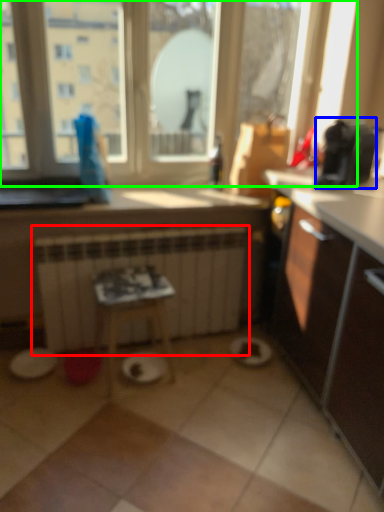
Question: Which object is positioned farthest from radiator (highlighted by a red box)? Select from appliance (highlighted by a blue box) and window (highlighted by a green box).

Choices:
 (A) appliance
 (B) window

Answer: (A)